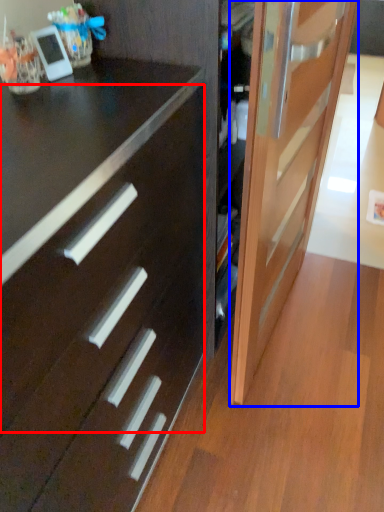
Question: Which object is further to the camera taking this photo, drawer (highlighted by a red box) or door (highlighted by a blue box)?

Choices:
 (A) drawer
 (B) door

Answer: (B)